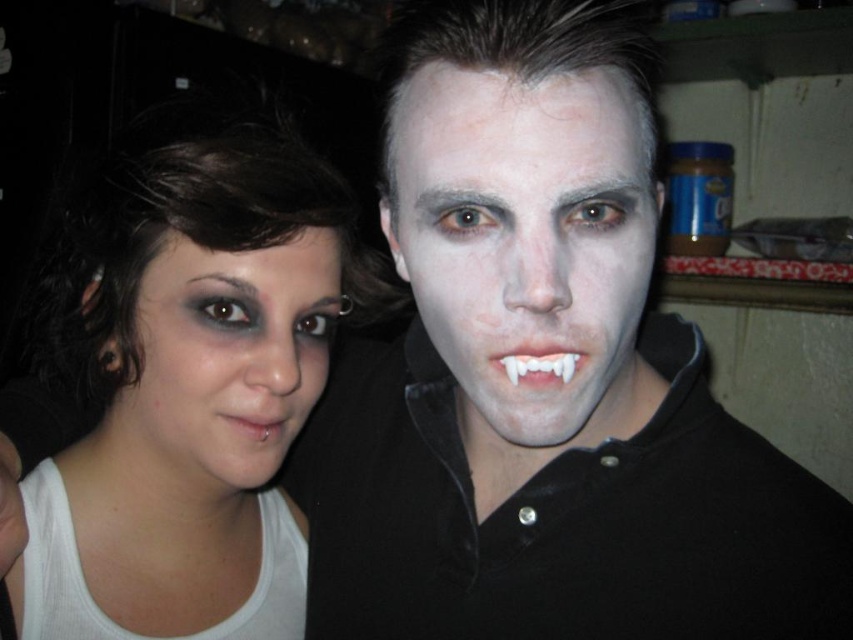
Question: Can you confirm if white matte face paint at center is smaller than pierced flesh at lower center?

Choices:
 (A) no
 (B) yes

Answer: (A)

Question: Where is white matte face paint at center located in relation to pierced flesh at lower center in the image?

Choices:
 (A) below
 (B) above

Answer: (A)

Question: Among these objects, which one is farthest from the camera?

Choices:
 (A) matte black eye makeup at center
 (B) white matte face at center
 (C) white matte face paint at center

Answer: (A)

Question: Which object is the farthest from the pierced flesh at lower center?

Choices:
 (A) matte black eye makeup at center
 (B) white matte skin at center
 (C) white plastic teeth at center
 (D) white matte face at center

Answer: (C)

Question: Which point is farther from the camera taking this photo?

Choices:
 (A) (424, 72)
 (B) (274, 493)

Answer: (B)

Question: Can you confirm if matte black eye makeup at center is thinner than white plastic teeth at center?

Choices:
 (A) no
 (B) yes

Answer: (A)